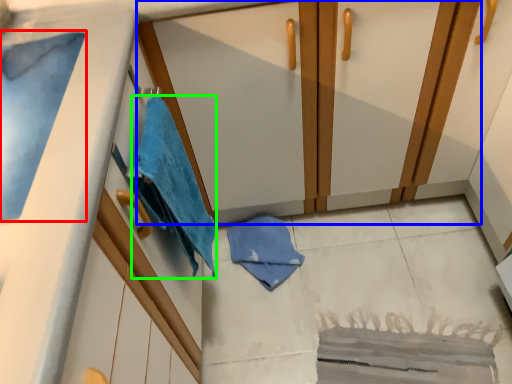
Question: Which object is positioned farthest from bath towel (highlighted by a red box)? Select from dresser (highlighted by a blue box) and beach towel (highlighted by a green box).

Choices:
 (A) dresser
 (B) beach towel

Answer: (A)